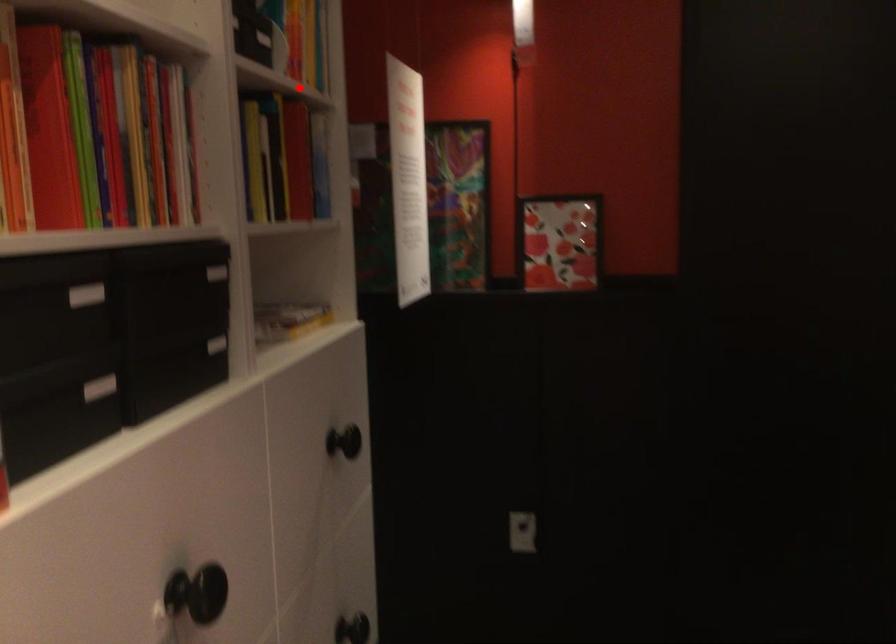
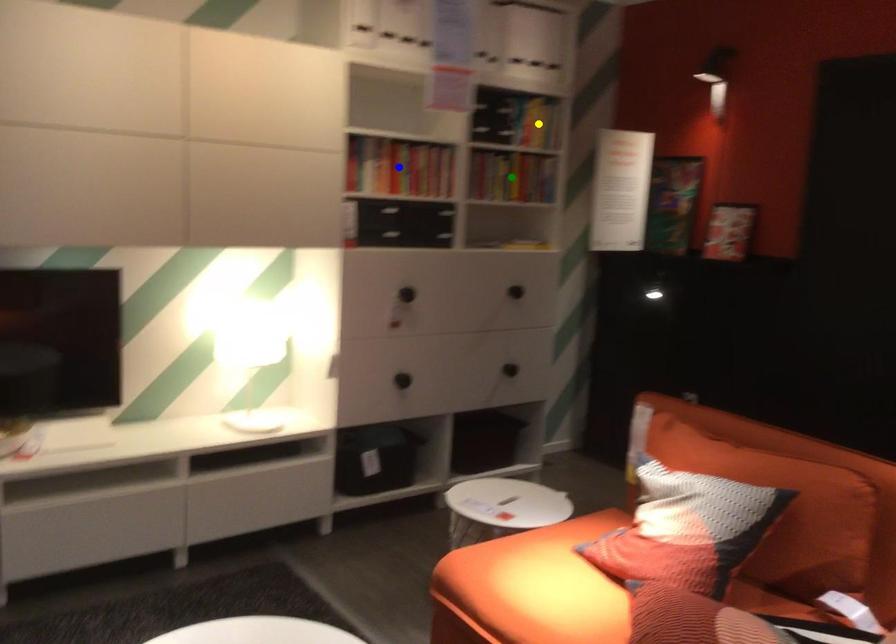
Question: I am providing you with two images of the same scene from different viewpoints. A red point is marked on the first image. You are given multiple points on the second image. Which mark in image 2 goes with the point in image 1?

Choices:
 (A) blue point
 (B) yellow point
 (C) green point

Answer: (B)